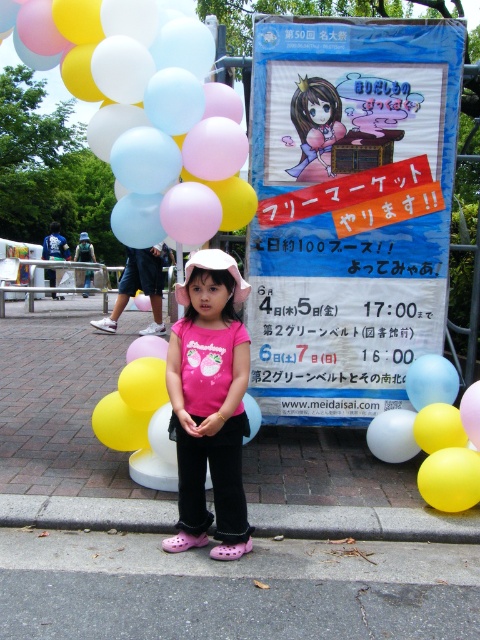
What is the exact location of the blue paper sign at center in the image?

The blue paper sign at center is located at point (348, 209).

You are a photographer trying to capture the young girl in the pink T shirt with strawberry graphics and the two objects in the scene. Which object, the matte balloons at center or the gray concrete curb at lower center, will appear larger in your photo?

The matte balloons at center will appear larger in the photo because they are bigger than the gray concrete curb at lower center according to the description.